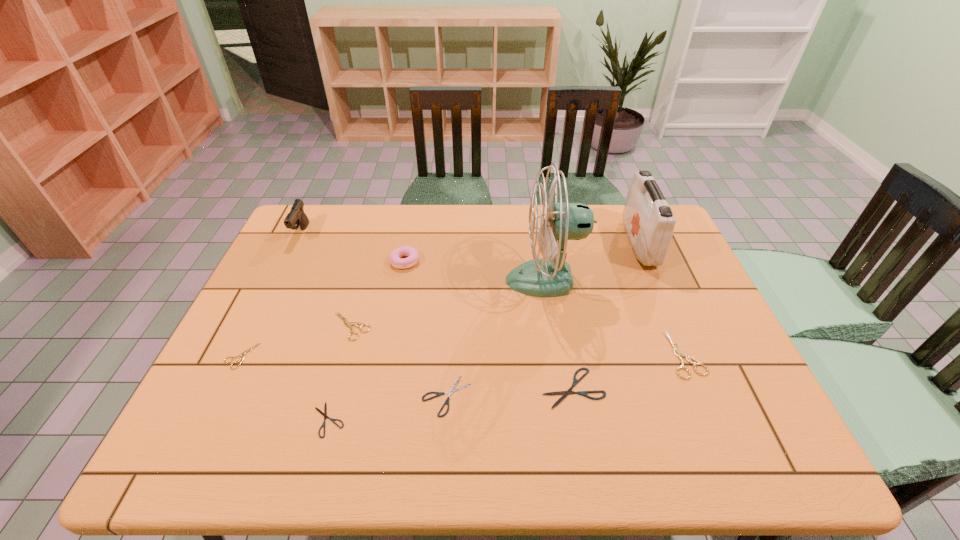
What are the coordinates of `free space located 0.240m on the left of the second shears from right to left` in the screenshot? It's located at (440, 388).

The width and height of the screenshot is (960, 540). What are the coordinates of `blank space located 0.390m on the right of the leftmost shears` in the screenshot? It's located at (410, 356).

The height and width of the screenshot is (540, 960). I want to click on free space located 0.100m on the left of the fifth object from right to left, so click(x=379, y=396).

Find the location of a particular element. Image resolution: width=960 pixels, height=540 pixels. blank space located 0.060m on the front of the leftmost black shears is located at coordinates (316, 466).

At what (x,y) coordinates should I click in order to perform the action: click on the first-aid kit positioned at the far edge. Please return your answer as a coordinate pair (x, y). This screenshot has width=960, height=540. Looking at the image, I should click on (648, 220).

This screenshot has width=960, height=540. Identify the location of pistol that is at the far edge. (296, 217).

The image size is (960, 540). In order to click on object at the near edge in this screenshot , I will do pos(324,414).

At what (x,y) coordinates should I click in order to perform the action: click on pistol that is at the left edge. Please return your answer as a coordinate pair (x, y). The image size is (960, 540). Looking at the image, I should click on (296, 217).

The image size is (960, 540). Identify the location of shears present at the left edge. (x=243, y=354).

Identify the location of the first-aid kit that is at the right edge. [x=648, y=220].